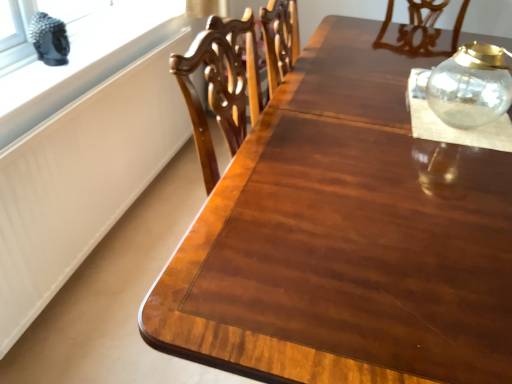
Question: From the image's perspective, is transparent glass jar at upper right beneath transparent glass jar at upper right?

Choices:
 (A) yes
 (B) no

Answer: (B)

Question: Does transparent glass jar at upper right have a larger size compared to transparent glass jar at upper right?

Choices:
 (A) yes
 (B) no

Answer: (A)

Question: Is transparent glass jar at upper right completely or partially outside of transparent glass jar at upper right?

Choices:
 (A) no
 (B) yes

Answer: (B)

Question: Considering the relative positions of transparent glass jar at upper right and transparent glass jar at upper right in the image provided, is transparent glass jar at upper right to the left of transparent glass jar at upper right from the viewer's perspective?

Choices:
 (A) yes
 (B) no

Answer: (B)

Question: Does transparent glass jar at upper right have a lesser height compared to transparent glass jar at upper right?

Choices:
 (A) no
 (B) yes

Answer: (A)

Question: Would you say white matte window sill at upper left is to the left or to the right of transparent glass jar at upper right in the picture?

Choices:
 (A) left
 (B) right

Answer: (A)

Question: From the image's perspective, is white matte window sill at upper left located above or below transparent glass jar at upper right?

Choices:
 (A) below
 (B) above

Answer: (A)

Question: Is point (115, 43) closer or farther from the camera than point (367, 74)?

Choices:
 (A) farther
 (B) closer

Answer: (A)

Question: From their relative heights in the image, would you say white matte window sill at upper left is taller or shorter than transparent glass jar at upper right?

Choices:
 (A) tall
 (B) short

Answer: (B)

Question: From a real-world perspective, is transparent glass jar at upper right physically located above or below transparent glass jar at upper right?

Choices:
 (A) above
 (B) below

Answer: (A)

Question: Is transparent glass jar at upper right inside the boundaries of transparent glass jar at upper right, or outside?

Choices:
 (A) outside
 (B) inside

Answer: (A)

Question: Is transparent glass jar at upper right in front of or behind transparent glass jar at upper right in the image?

Choices:
 (A) front
 (B) behind

Answer: (A)

Question: Is transparent glass jar at upper right taller or shorter than transparent glass jar at upper right?

Choices:
 (A) tall
 (B) short

Answer: (B)

Question: From a real-world perspective, is transparent glass jar at upper right above or below white matte window sill at upper left?

Choices:
 (A) above
 (B) below

Answer: (A)

Question: Is transparent glass jar at upper right taller or shorter than white matte window sill at upper left?

Choices:
 (A) short
 (B) tall

Answer: (B)